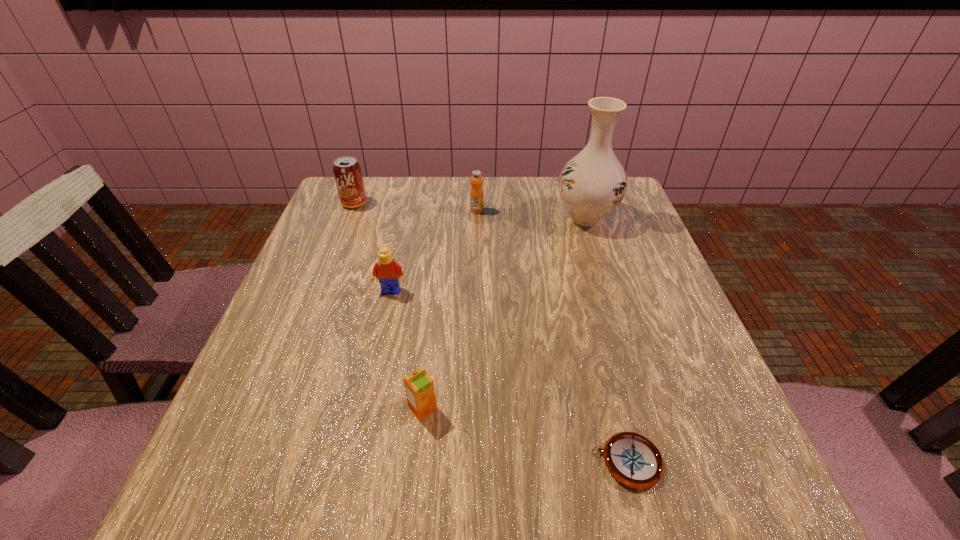
Identify the location of vase. Image resolution: width=960 pixels, height=540 pixels. (592, 183).

The height and width of the screenshot is (540, 960). In order to click on the leftmost object in this screenshot , I will do `click(347, 171)`.

At what (x,y) coordinates should I click in order to perform the action: click on the right orange juice. Please return your answer as a coordinate pair (x, y). The height and width of the screenshot is (540, 960). Looking at the image, I should click on (476, 193).

The width and height of the screenshot is (960, 540). What are the coordinates of `the farther orange juice` in the screenshot? It's located at (476, 193).

Image resolution: width=960 pixels, height=540 pixels. I want to click on Lego, so click(x=388, y=272).

Locate an element on the screen. The image size is (960, 540). the second object from left to right is located at coordinates pyautogui.click(x=388, y=272).

I want to click on the left orange juice, so click(x=419, y=386).

Identify the location of the nearer orange juice. The image size is (960, 540). (419, 386).

You are a GUI agent. You are given a task and a screenshot of the screen. Output one action in this format:
    pyautogui.click(x=<x>, y=<y>)
    Task: Click on the compass
    
    Given the screenshot: What is the action you would take?
    pyautogui.click(x=632, y=459)

At what (x,y) coordinates should I click in order to perform the action: click on the shortest object. Please return your answer as a coordinate pair (x, y). This screenshot has width=960, height=540. Looking at the image, I should click on (632, 459).